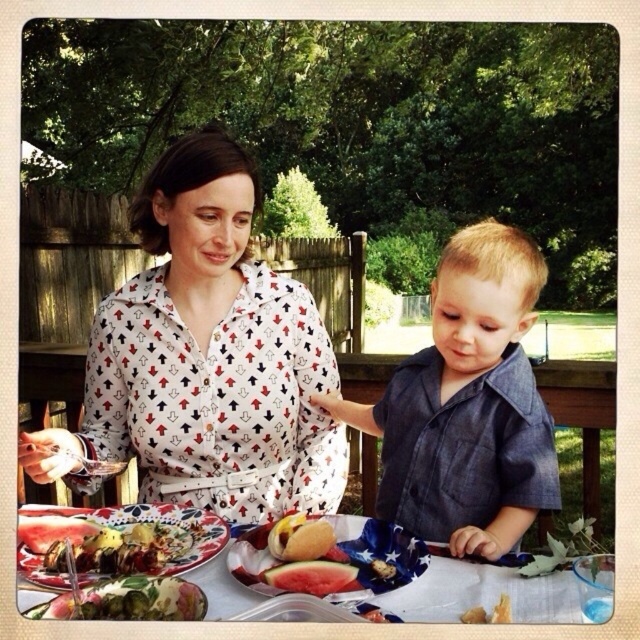
How distant is denim shirt at center from glazed ceramic platter at lower left?

The distance of denim shirt at center from glazed ceramic platter at lower left is 45.54 centimeters.

Does denim shirt at center have a lesser width compared to glazed ceramic platter at lower left?

In fact, denim shirt at center might be wider than glazed ceramic platter at lower left.

Does point (474, 360) lie in front of point (152, 531)?

No, it is not.

The width and height of the screenshot is (640, 640). What are the coordinates of `denim shirt at center` in the screenshot? It's located at (467, 404).

Where is `white printed shirt at upper center`? white printed shirt at upper center is located at coordinates (205, 358).

At what (x,y) coordinates should I click in order to perform the action: click on white printed shirt at upper center. Please return your answer as a coordinate pair (x, y). Image resolution: width=640 pixels, height=640 pixels. Looking at the image, I should click on (205, 358).

Does point (301, 572) come closer to viewer compared to point (120, 612)?

No, it is not.

Image resolution: width=640 pixels, height=640 pixels. Find the location of `watermelon slices at center`. watermelon slices at center is located at coordinates (332, 563).